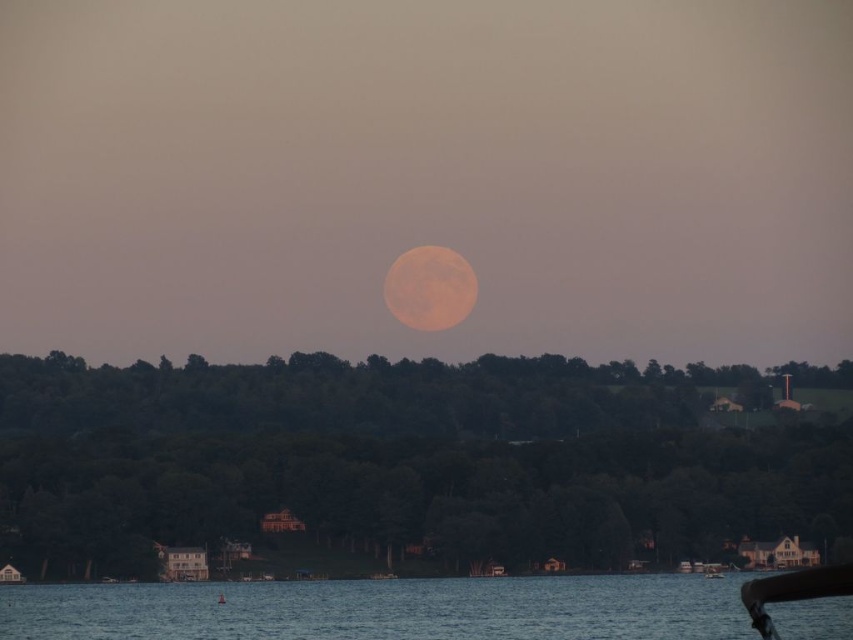
Which of these two, orange matte moon at center or wooden boat at center, stands taller?

orange matte moon at center

Who is positioned more to the left, orange matte moon at center or wooden boat at center?

orange matte moon at center is more to the left.

This screenshot has height=640, width=853. What do you see at coordinates (405, 464) in the screenshot?
I see `orange matte moon at center` at bounding box center [405, 464].

You are a GUI agent. You are given a task and a screenshot of the screen. Output one action in this format:
    pyautogui.click(x=<x>, y=<y>)
    Task: Click on the orange matte moon at center
    Image resolution: width=853 pixels, height=640 pixels.
    Given the screenshot: What is the action you would take?
    (x=405, y=464)

Looking at this image, is orange matte moon at center bigger than orange textured moon at center?

Correct, orange matte moon at center is larger in size than orange textured moon at center.

Is point (509, 371) positioned after point (476, 284)?

No, it is in front of (476, 284).

Locate an element on the screen. orange matte moon at center is located at coordinates (405, 464).

I want to click on blue water at lower center, so click(x=384, y=609).

Who is more forward, (213, 632) or (440, 316)?

Point (213, 632)

You are a GUI agent. You are given a task and a screenshot of the screen. Output one action in this format:
    pyautogui.click(x=<x>, y=<y>)
    Task: Click on the blue water at lower center
    
    Given the screenshot: What is the action you would take?
    pyautogui.click(x=384, y=609)